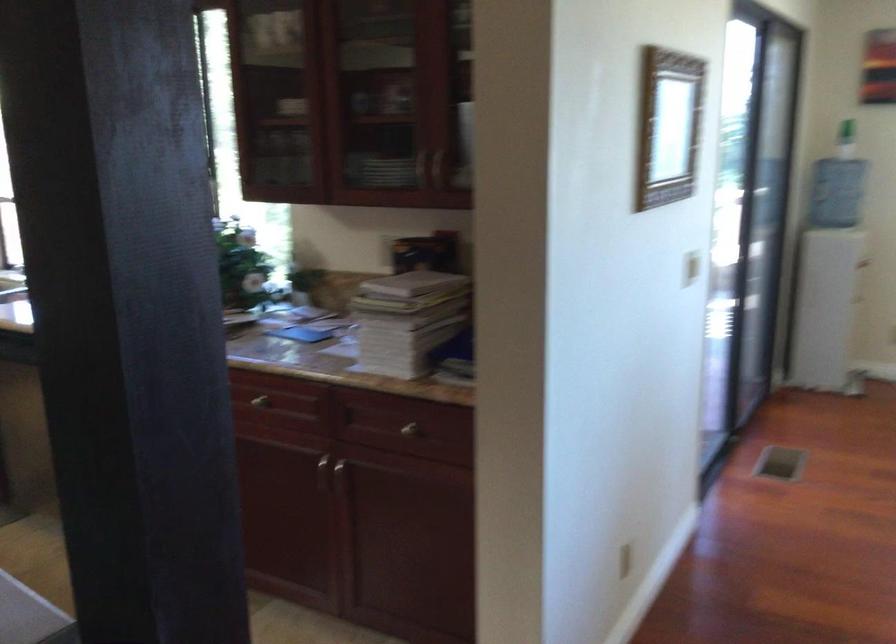
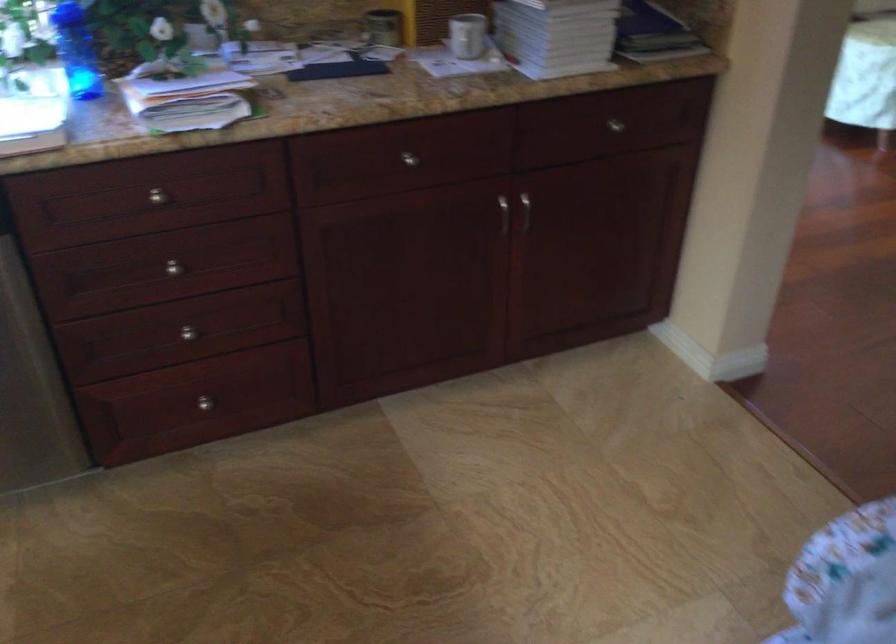
In the second image, find the point that corresponds to point 407,431 in the first image.

(615, 125)